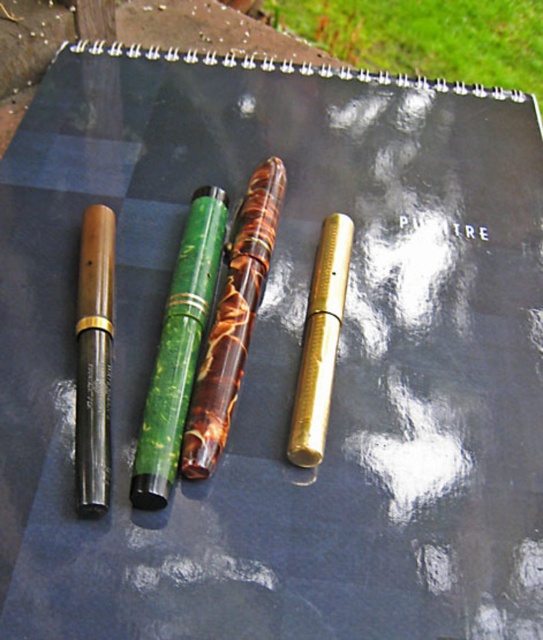
You are standing in front of the fountain pens arranged on the dark surface. There are two points marked on the image at coordinates point (172, 372) and point (80, 390). Which point is closer to you?

Point (172, 372) is closer to you because it is further to the viewer than point (80, 390).

Consider the image. You are an artist trying to place a new pen between the green marble pen at center and the brown pen to the right. Based on their positions, can you determine if there is enough space between them to fit a pen that is 2 cm wide?

The green marble pen at center is located at point (179, 349) and the brown pen is at point (179, 411). The distance between them is approximately 0.096 units. Assuming the units are in meters, this translates to about 9.6 cm. Since the new pen is 2 cm wide, there is sufficient space to fit it between them.